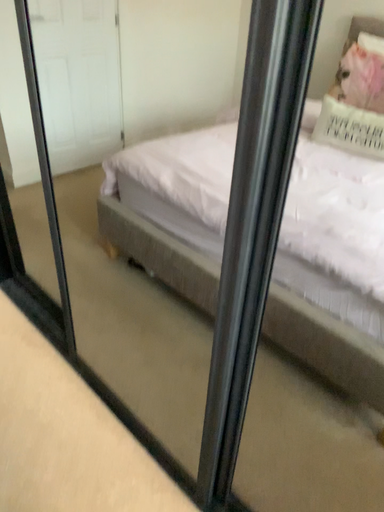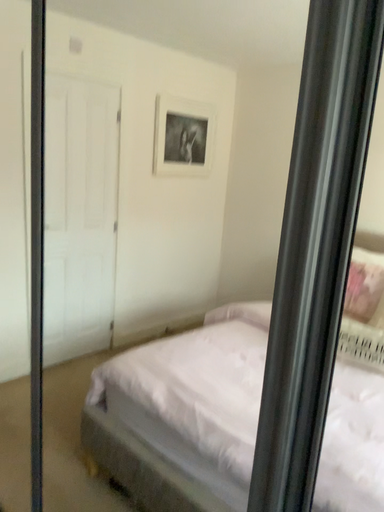
Question: Which way did the camera rotate in the video?

Choices:
 (A) rotated upward
 (B) rotated downward

Answer: (A)